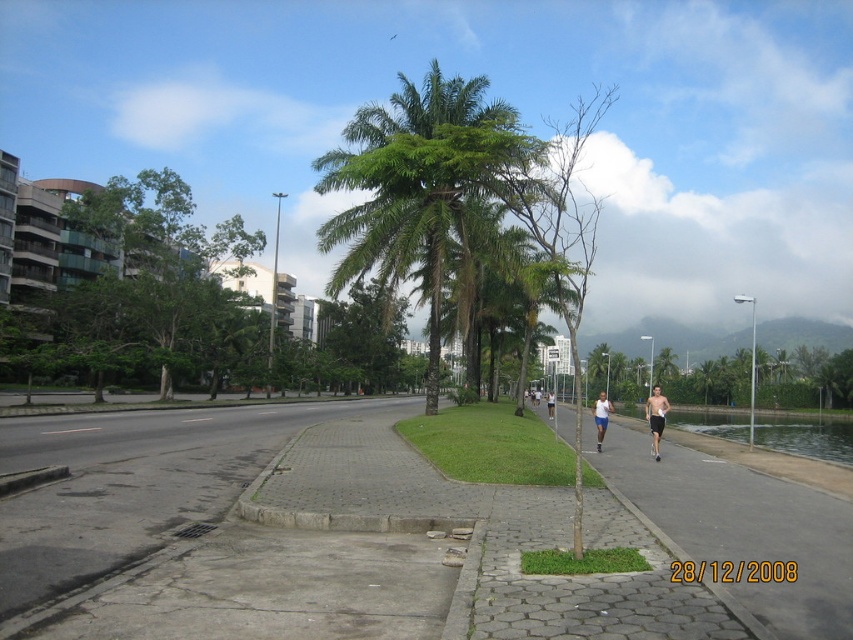
Does black matte shorts at center-right have a lesser width compared to white cotton shirt at right?

In fact, black matte shorts at center-right might be wider than white cotton shirt at right.

Does black matte shorts at center-right lie behind white cotton shirt at right?

No, black matte shorts at center-right is closer to the viewer.

Describe the element at coordinates (656, 417) in the screenshot. This screenshot has width=853, height=640. I see `black matte shorts at center-right` at that location.

What are the coordinates of `black matte shorts at center-right` in the screenshot? It's located at (656, 417).

Does black matte shorts at center-right appear under white fabric shorts at center-right?

Incorrect, black matte shorts at center-right is not positioned below white fabric shorts at center-right.

Does black matte shorts at center-right come in front of white fabric shorts at center-right?

Yes, black matte shorts at center-right is in front of white fabric shorts at center-right.

You are a GUI agent. You are given a task and a screenshot of the screen. Output one action in this format:
    pyautogui.click(x=<x>, y=<y>)
    Task: Click on the black matte shorts at center-right
    This screenshot has width=853, height=640.
    Given the screenshot: What is the action you would take?
    pyautogui.click(x=656, y=417)

Does green leafy palm tree at center have a smaller size compared to black matte shorts at center-right?

Actually, green leafy palm tree at center might be larger than black matte shorts at center-right.

Is green leafy palm tree at center to the left of black matte shorts at center-right from the viewer's perspective?

Correct, you'll find green leafy palm tree at center to the left of black matte shorts at center-right.

Identify the location of green leafy palm tree at center. (426, 195).

Locate an element on the screen. green leafy palm tree at center is located at coordinates (426, 195).